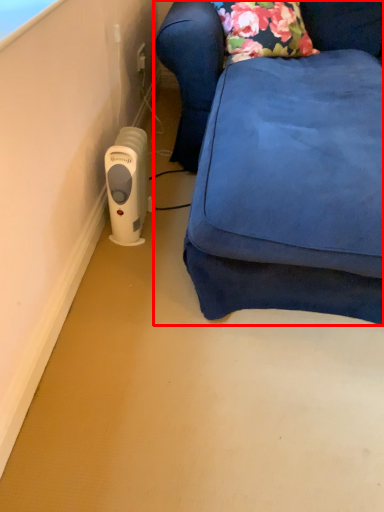
Question: Where is furniture (annotated by the red box) located in relation to home appliance in the image?

Choices:
 (A) right
 (B) left

Answer: (A)